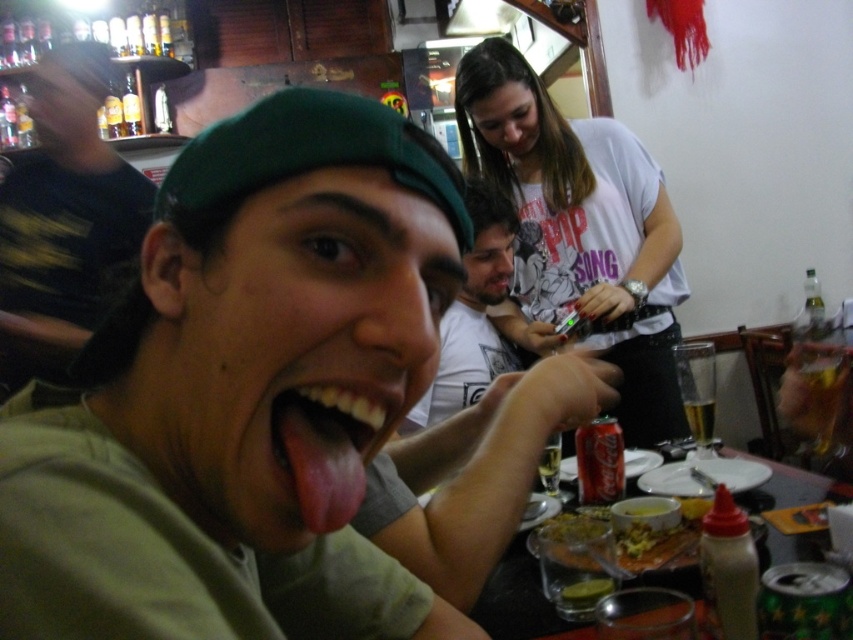
Question: Does green fabric cap at center have a smaller size compared to red matte coca-cola can at center?

Choices:
 (A) yes
 (B) no

Answer: (B)

Question: Does pink glossy tongue at center appear on the right side of red matte coca-cola can at center?

Choices:
 (A) yes
 (B) no

Answer: (B)

Question: Which of the following is the closest to the observer?

Choices:
 (A) (607, 458)
 (B) (90, 168)
 (C) (380, 413)

Answer: (C)

Question: Is white cotton shirt at upper center smaller than smooth plastic table at center?

Choices:
 (A) yes
 (B) no

Answer: (B)

Question: Which of the following is the closest to the observer?

Choices:
 (A) (392, 483)
 (B) (289, 429)
 (C) (0, 380)

Answer: (B)

Question: Which point is closer to the camera taking this photo?

Choices:
 (A) (573, 433)
 (B) (631, 497)
 (C) (793, 472)
 (D) (659, 246)

Answer: (B)